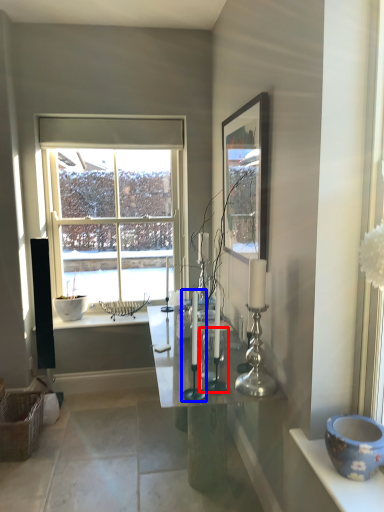
Question: Which object appears farthest to the camera in this image, candle holder (highlighted by a red box) or candle holder (highlighted by a blue box)?

Choices:
 (A) candle holder
 (B) candle holder

Answer: (A)